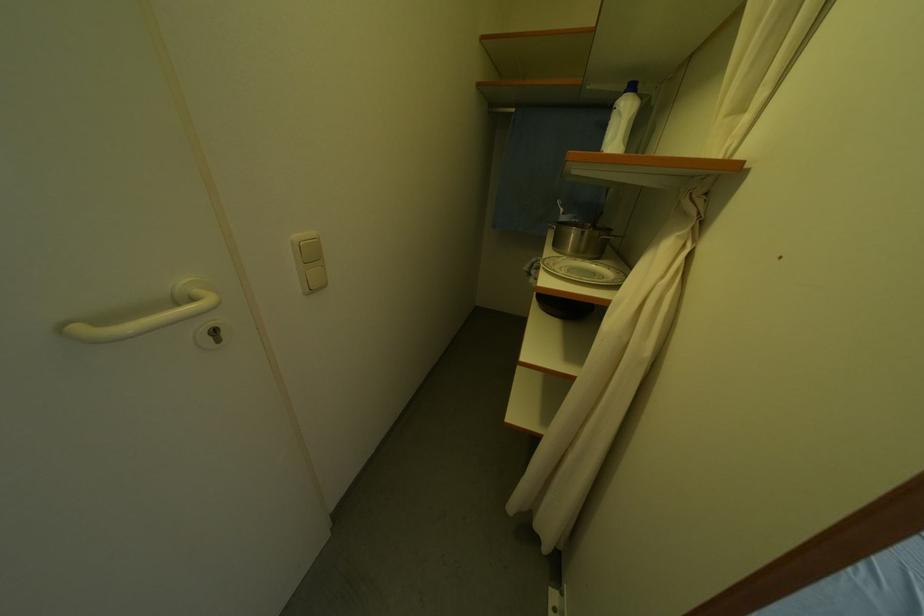
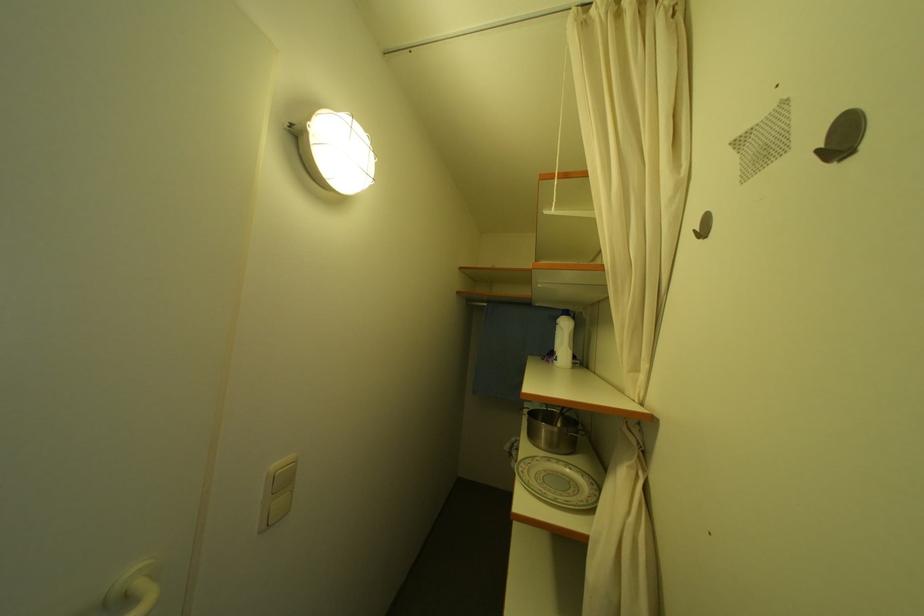
Question: The images are taken continuously from a first-person perspective. In which direction is your viewpoint rotating?

Choices:
 (A) Left
 (B) Right
 (C) Up
 (D) Down

Answer: (C)